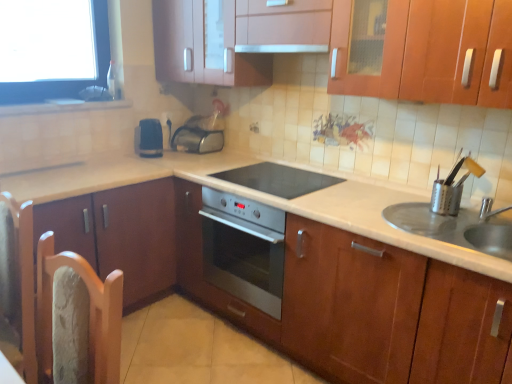
At what (x,y) coordinates should I click in order to perform the action: click on free space above white glossy countertop at center (from a real-world perspective). Please return your answer as a coordinate pair (x, y). Looking at the image, I should click on (362, 202).